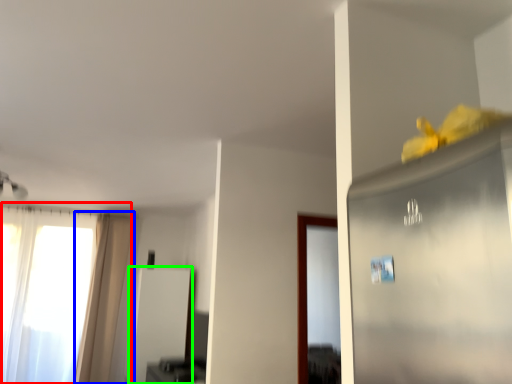
Question: Which object is positioned farthest from window (highlighted by a red box)? Select from curtain (highlighted by a blue box) and screen door (highlighted by a green box).

Choices:
 (A) curtain
 (B) screen door

Answer: (B)